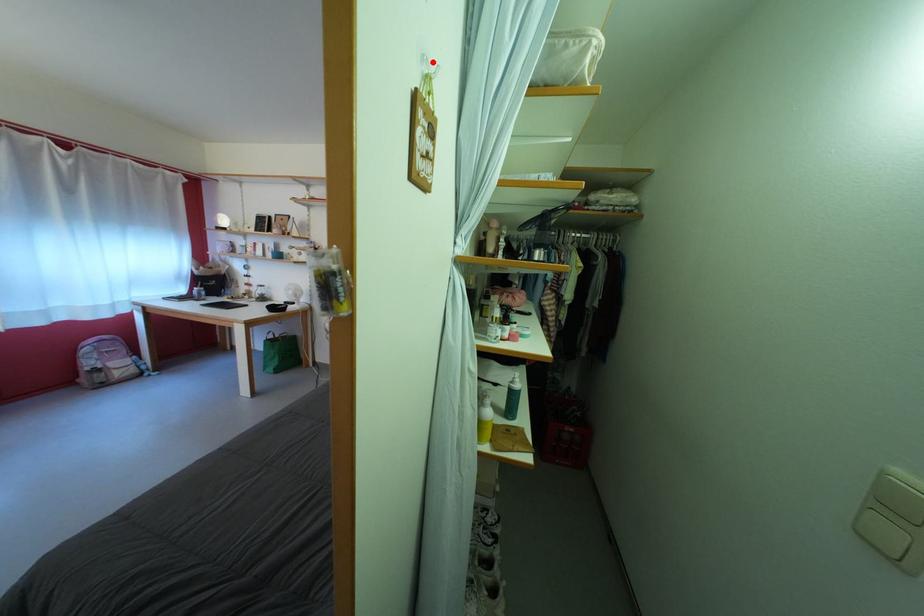
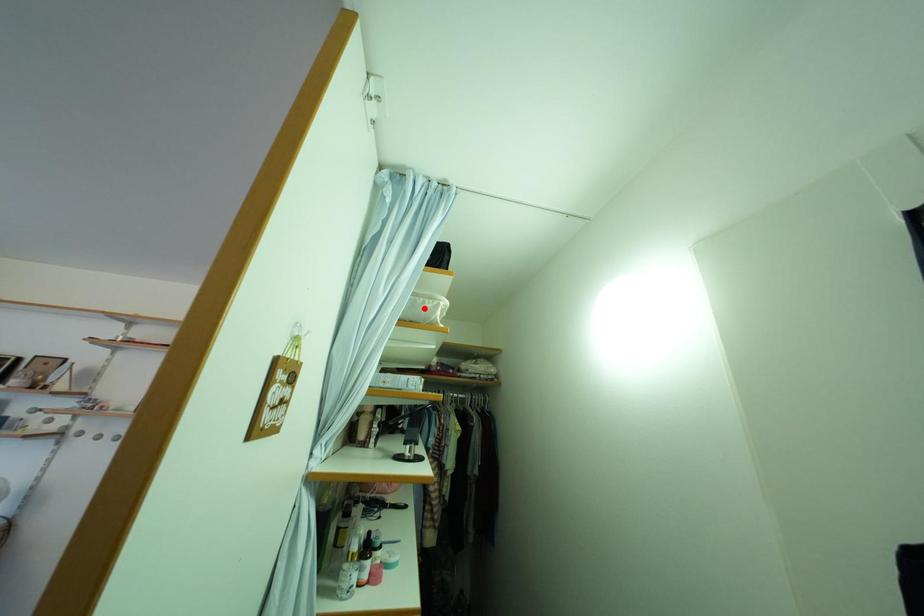
I am providing you with two images of the same scene from different viewpoints. A red point is marked on the first image and another point is marked on the second image. Does the point marked in image1 correspond to the same location as the one in image2?

No